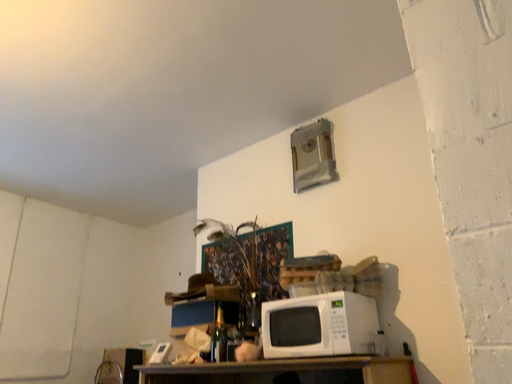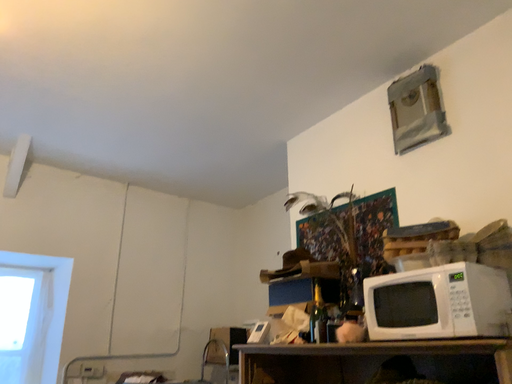
Question: Which way did the camera rotate in the video?

Choices:
 (A) rotated left
 (B) rotated right

Answer: (A)